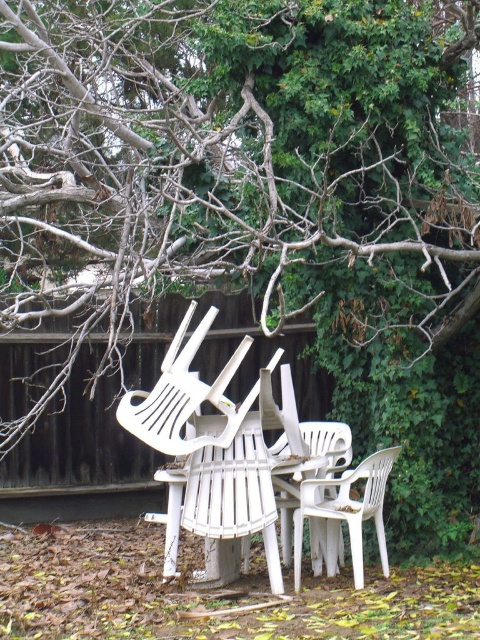
You are organizing a small garden party and need to place a new bench in the backyard. You have a bench that is the same size as the white plastic chair at lower right. Based on the scene, can the bench fit next to the brown bark tree at center without blocking the pathway?

The brown bark tree at center is larger in size than the white plastic chair at lower right. Since the bench is the same size as the chair, there should be enough space to place it next to the tree without blocking the pathway.

You are planning to hang a bird feeder from a branch. You see a brown bark tree at center and a white plastic chair at center. Which object would be more suitable for hanging the bird feeder?

The brown bark tree at center is taller than the white plastic chair at center, so it would be more suitable for hanging the bird feeder.

You are organizing a small outdoor gathering and need to move the white plastic chair at lower right and the white plastic chair at center to create space. Which chair should you move first to ensure the other can be moved without obstruction?

You should move the white plastic chair at center first because the white plastic chair at lower right is positioned to its right side. Moving the center chair first allows easier access to the chair at the lower right without obstruction.